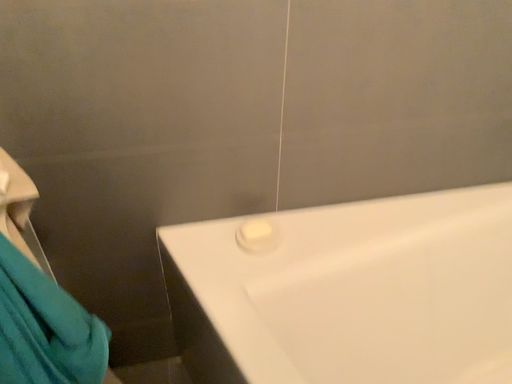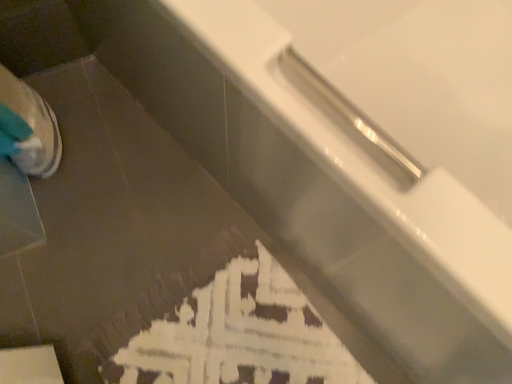
Question: How did the camera likely rotate when shooting the video?

Choices:
 (A) rotated left
 (B) rotated right

Answer: (B)